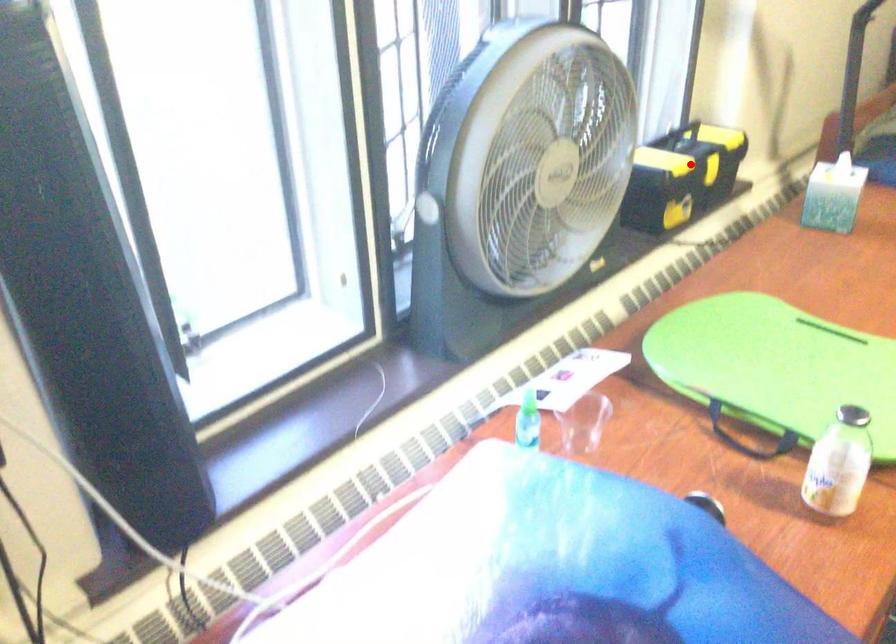
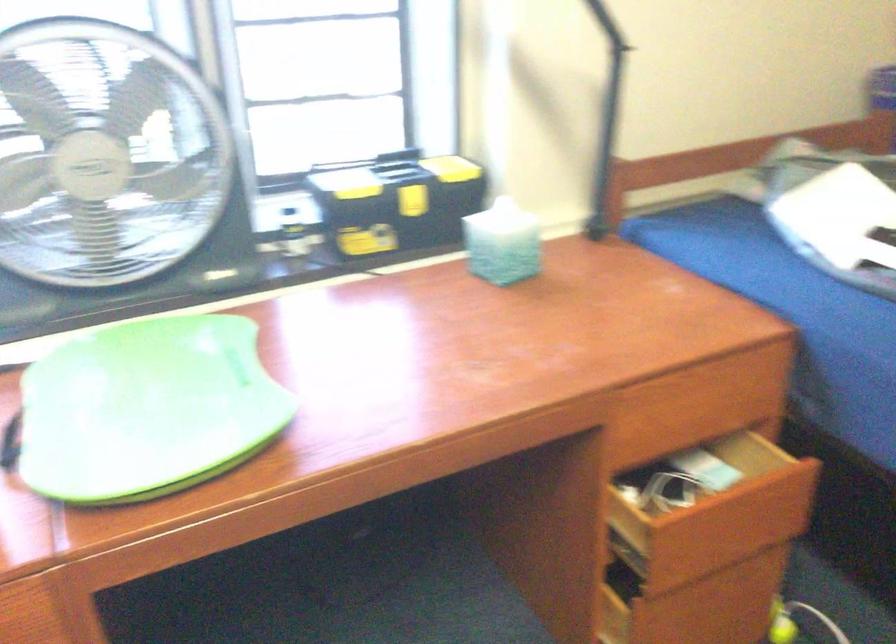
Locate, in the second image, the point that corresponds to the highlighted location in the first image.

(401, 185)